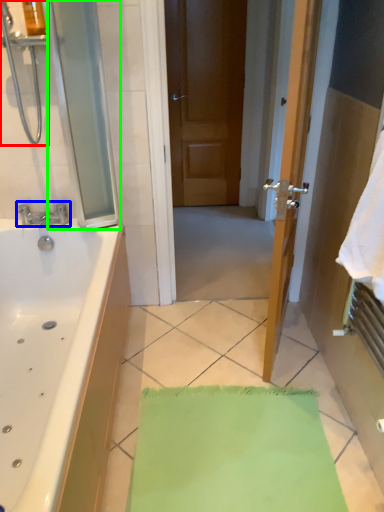
Question: Which object is positioned closest to shower (highlighted by a red box)? Select from tap (highlighted by a blue box) and screen door (highlighted by a green box).

Choices:
 (A) tap
 (B) screen door

Answer: (B)